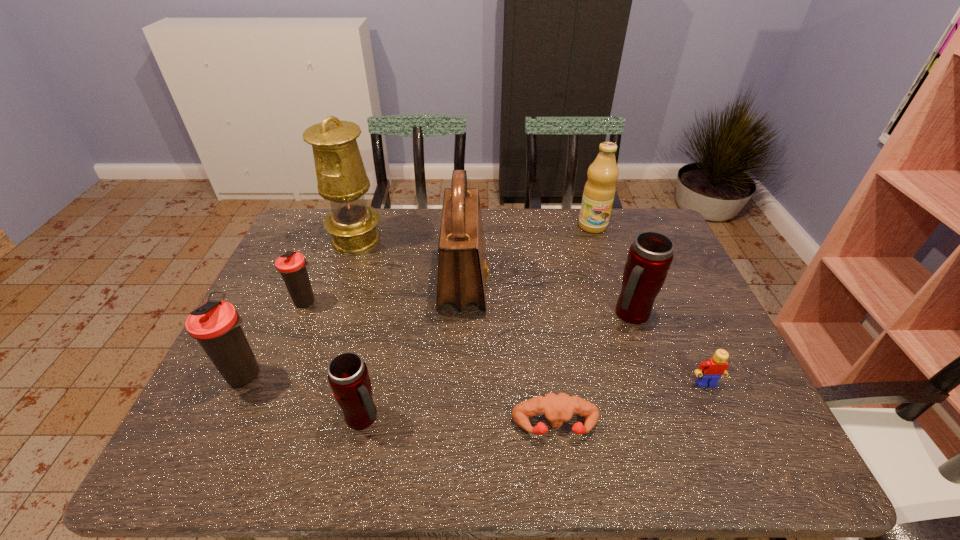
This screenshot has width=960, height=540. I want to click on free space between the oil lamp and the farther brown thermos bottle, so click(331, 270).

Find the location of a particular element. The image size is (960, 540). vacant space that's between the bigger brown thermos bottle and the farther brown thermos bottle is located at coordinates (276, 337).

At what (x,y) coordinates should I click in order to perform the action: click on vacant space that's between the smaller red thermos bottle and the olive oil. Please return your answer as a coordinate pair (x, y). The width and height of the screenshot is (960, 540). Looking at the image, I should click on (478, 321).

I want to click on unoccupied area between the right red thermos bottle and the smaller red thermos bottle, so click(497, 366).

You are a GUI agent. You are given a task and a screenshot of the screen. Output one action in this format:
    pyautogui.click(x=<x>, y=<y>)
    Task: Click on the vacant space that's between the red puncher and the bigger brown thermos bottle
    The width and height of the screenshot is (960, 540).
    Given the screenshot: What is the action you would take?
    pyautogui.click(x=400, y=400)

Where is `object identified as the second closest to the fifth object from right to left`? This screenshot has width=960, height=540. object identified as the second closest to the fifth object from right to left is located at coordinates (348, 376).

Find the location of a particular element. The height and width of the screenshot is (540, 960). the second closest object relative to the oil lamp is located at coordinates (462, 271).

Locate which thermos bottle ranks third in proximity to the nearest thermos bottle. Please provide its 2D coordinates. Your answer should be formatted as a tuple, i.e. [(x, y)], where the tuple contains the x and y coordinates of a point satisfying the conditions above.

[(650, 256)]

The height and width of the screenshot is (540, 960). I want to click on thermos bottle that stands as the closest to the right red thermos bottle, so click(x=348, y=376).

This screenshot has height=540, width=960. I want to click on free spot that satisfies the following two spatial constraints: 1. on the face of the rightmost object; 2. on the side with the handle of the third thermos bottle from left to right, so click(721, 417).